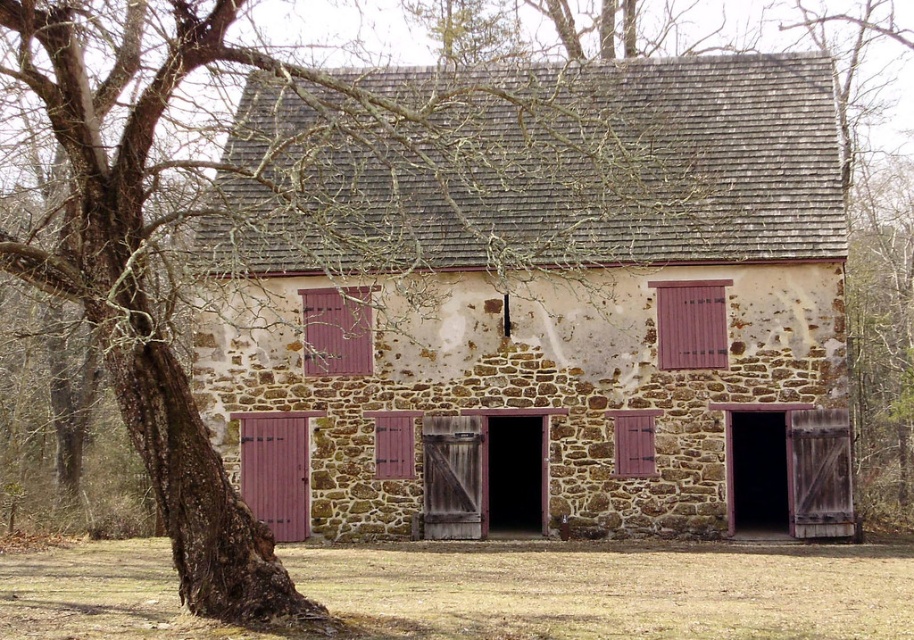
Question: Which object appears closest to the camera in this image?

Choices:
 (A) purple wood shutter at right
 (B) matte wood door at lower left

Answer: (A)

Question: Does matte wood door at lower left come behind wooden textured shutter at center?

Choices:
 (A) no
 (B) yes

Answer: (B)

Question: Can you confirm if purple wood shutter at right is positioned above pink wood shutter at center?

Choices:
 (A) yes
 (B) no

Answer: (A)

Question: Which object is positioned closest to the pink wood shutter at center?

Choices:
 (A) matte wood door at lower left
 (B) purple wood shutter at right
 (C) stone barn at center
 (D) wooden textured shutter at center

Answer: (A)

Question: Is stone barn at center thinner than purple wood shutter at right?

Choices:
 (A) yes
 (B) no

Answer: (B)

Question: Estimate the real-world distances between objects in this image. Which object is farther from the matte wood shutter at center?

Choices:
 (A) wooden textured shutter at center
 (B) pink wood shutter at center

Answer: (A)